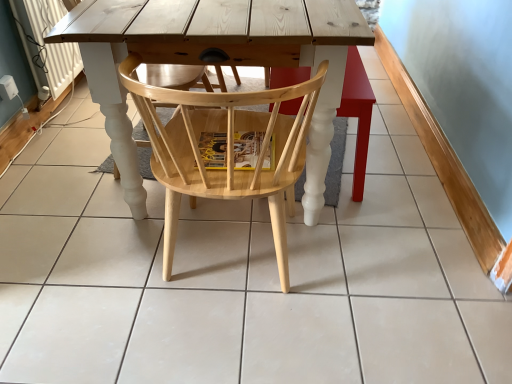
At what (x,y) coordinates should I click in order to perform the action: click on free space to the right of natural wood chair at center. Please return your answer as a coordinate pair (x, y). Looking at the image, I should click on (379, 275).